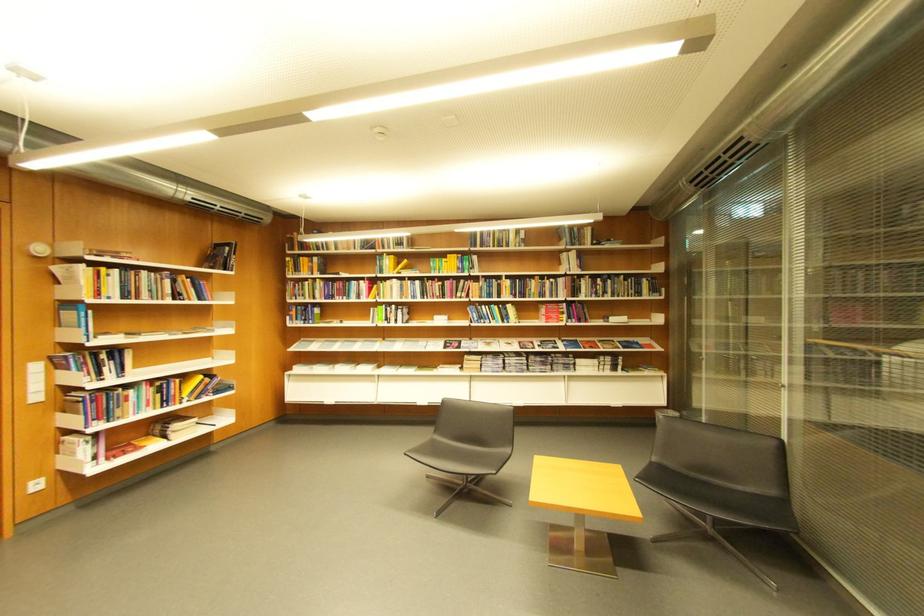
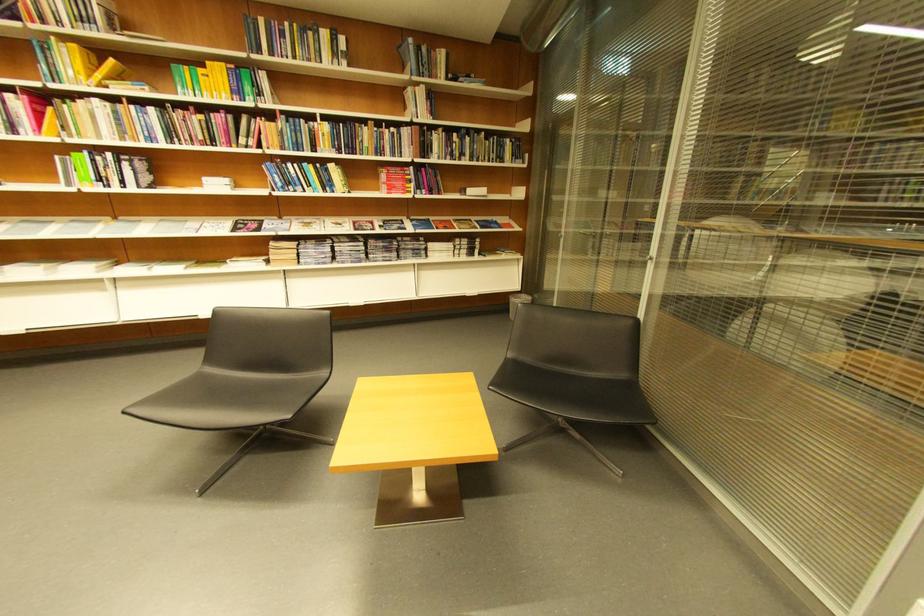
Find the pixel in the second image that matches pixel 466 257 in the first image.

(234, 66)